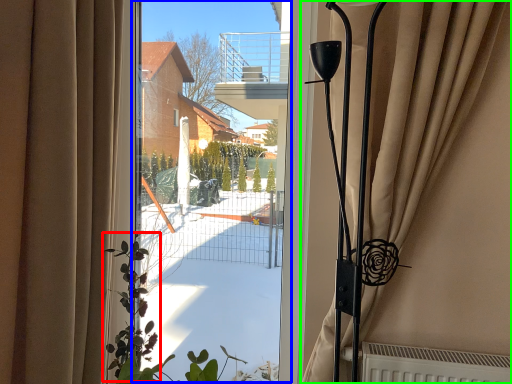
Question: Which object is positioned farthest from plant (highlighted by a red box)? Select from window screen (highlighted by a blue box) and curtain (highlighted by a green box).

Choices:
 (A) window screen
 (B) curtain

Answer: (B)